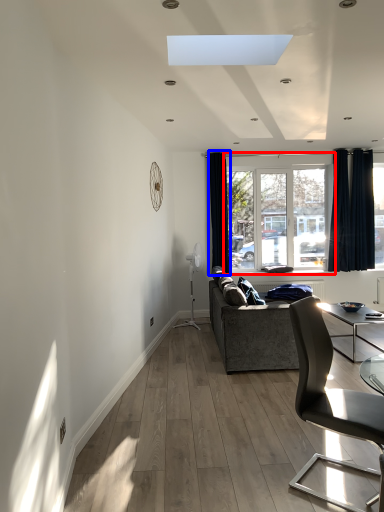
Question: Which object is further to the camera taking this photo, window (highlighted by a red box) or curtain (highlighted by a blue box)?

Choices:
 (A) window
 (B) curtain

Answer: (A)